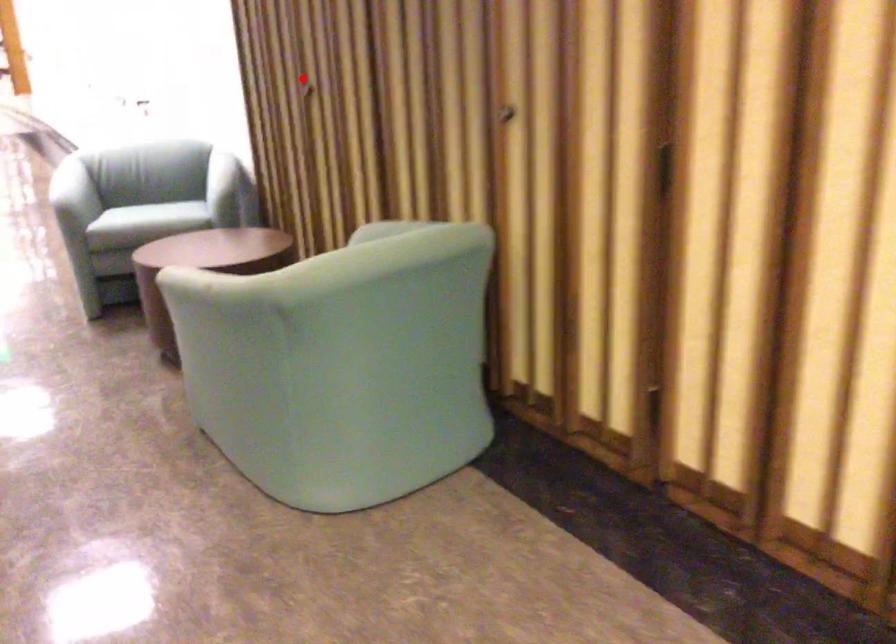
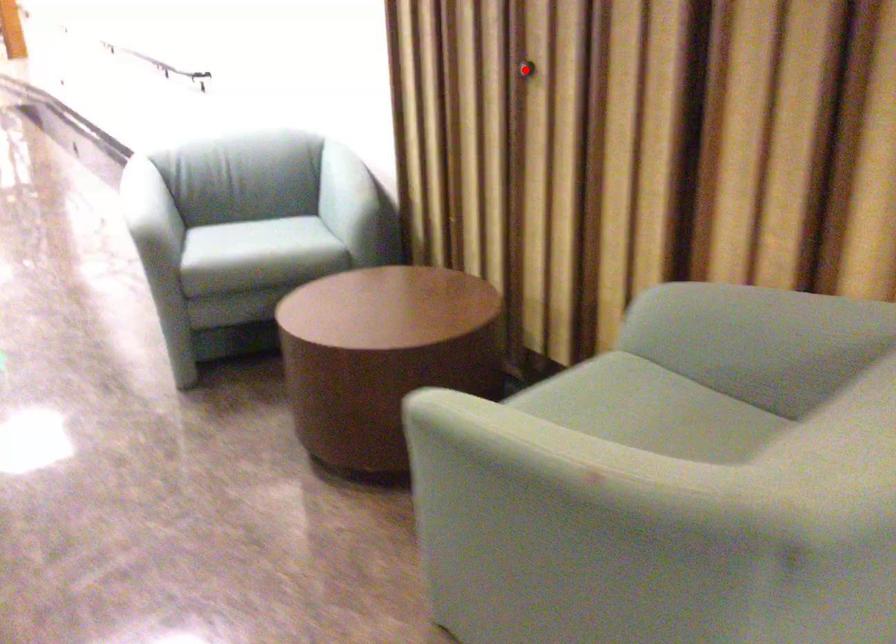
I am providing you with two images of the same scene from different viewpoints. A red point is marked on the first image and another point is marked on the second image. Do the highlighted points in image1 and image2 indicate the same real-world spot?

Yes